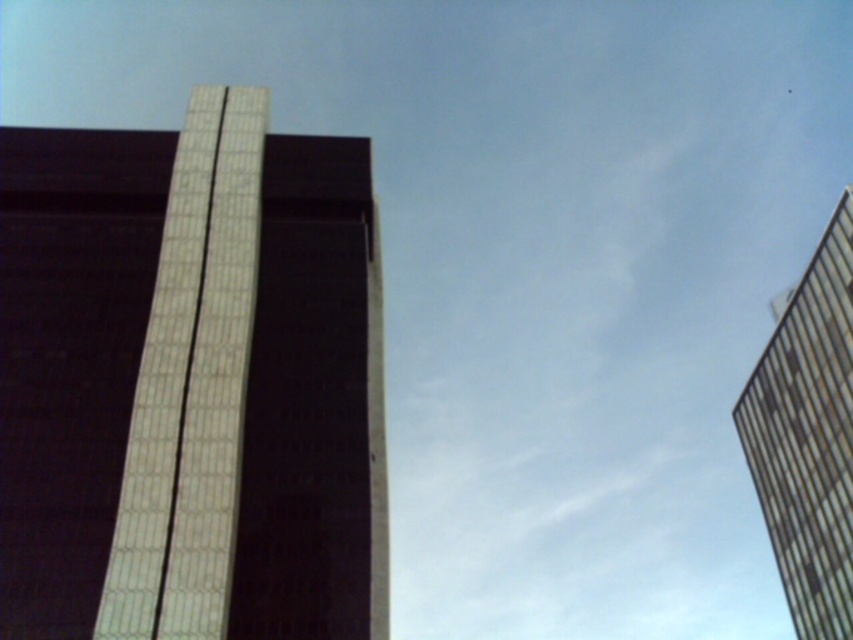
You are an architect analyzing the two buildings in the image. Which building is shorter between the white textured building at center and the metallic glass tower at right?

The white textured building at center is shorter than the metallic glass tower at right.

You are an architect evaluating the spatial layout of the buildings in the image. Which building, the white textured building at center or the metallic glass tower at right, would allow for wider floor plans due to its greater width?

The metallic glass tower at right has a greater width than the white textured building at center, so it would allow for wider floor plans.